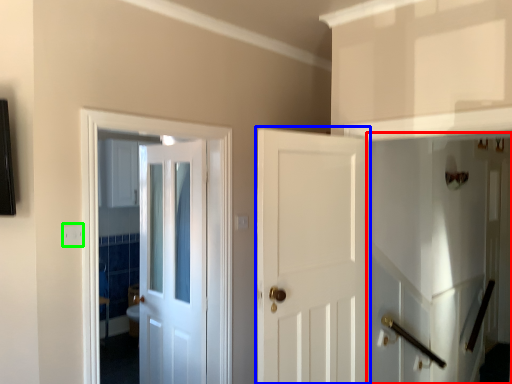
Question: Which object is the closest to the elevator (highlighted by a red box)? Choose among these: door (highlighted by a blue box) or electric outlet (highlighted by a green box).

Choices:
 (A) door
 (B) electric outlet

Answer: (A)